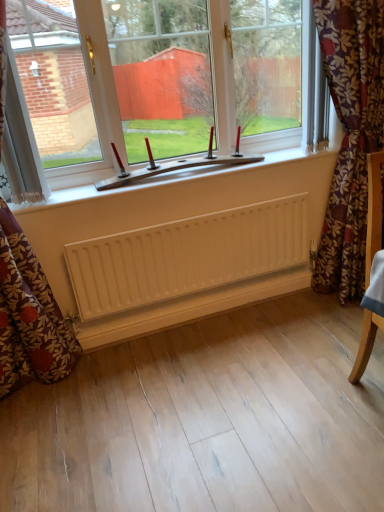
The height and width of the screenshot is (512, 384). Identify the location of spots to the right of floral fabric curtain at left, positioned as the 2th curtain in left-to-right order. (132, 382).